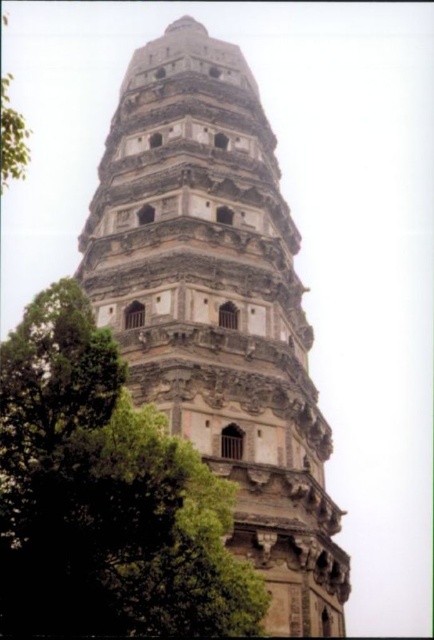
Based on the photo, can you confirm if stone tower at center is taller than green leafy tree at center?

Yes.

Between stone tower at center and green leafy tree at center, which one appears on the right side from the viewer's perspective?

From the viewer's perspective, stone tower at center appears more on the right side.

Which is behind, point (201, 362) or point (111, 570)?

Point (201, 362)

Locate an element on the screen. stone tower at center is located at coordinates (219, 307).